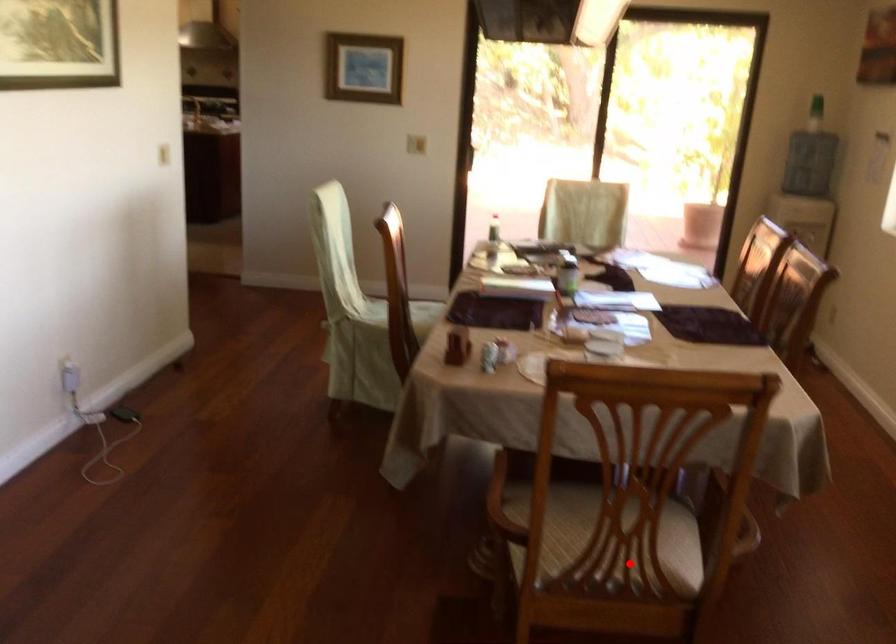
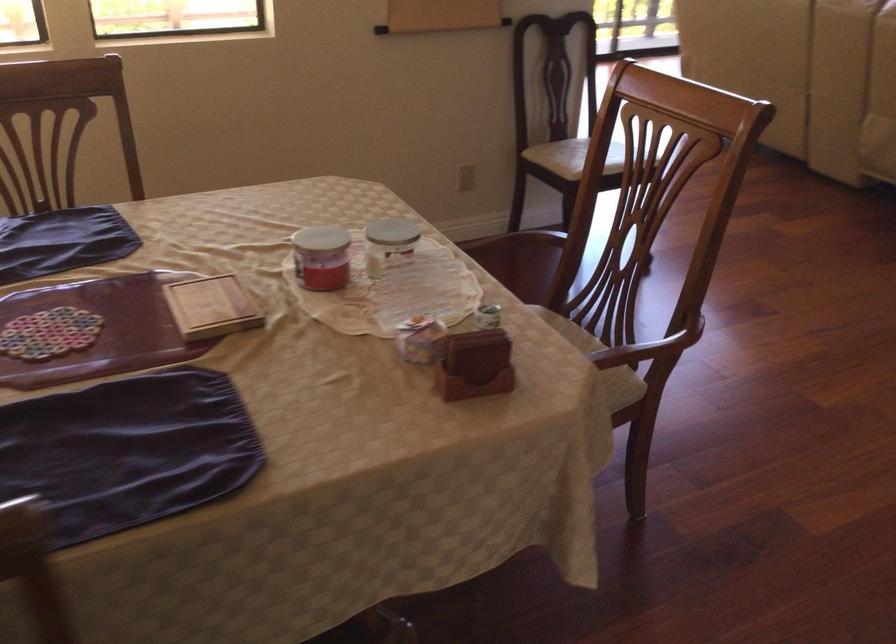
The point at the highlighted location is marked in the first image. Where is the corresponding point in the second image?

(564, 322)